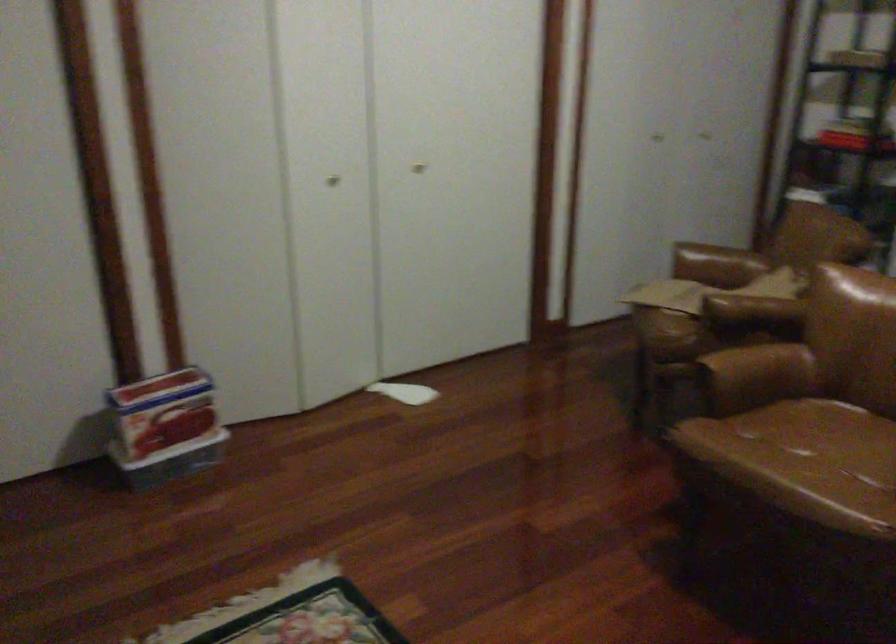
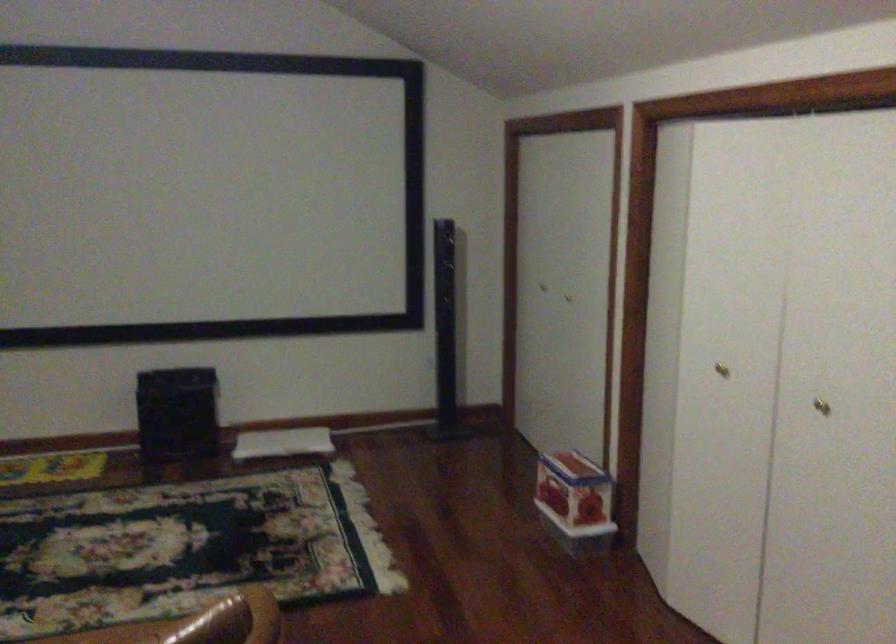
Locate, in the second image, the point that corresponds to [421,156] in the first image.

(821, 406)